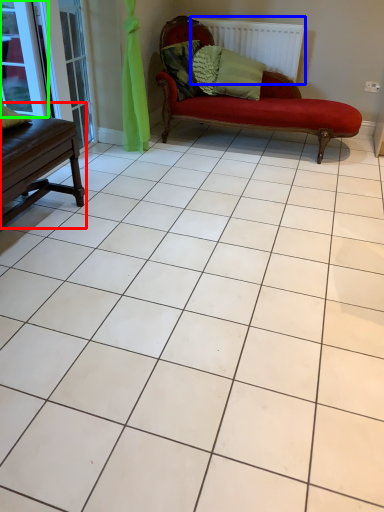
Question: Based on their relative distances, which object is farther from table (highlighted by a red box)? Choose from radiator (highlighted by a blue box) and window (highlighted by a green box).

Choices:
 (A) radiator
 (B) window

Answer: (A)